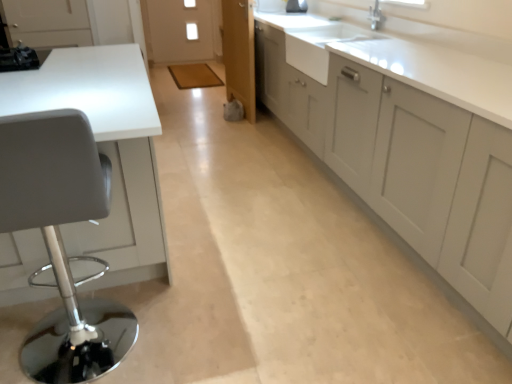
Question: Can you confirm if white glossy countertop at left is thinner than white ceramic sink at upper right?

Choices:
 (A) yes
 (B) no

Answer: (B)

Question: Is white glossy countertop at left in contact with white ceramic sink at upper right?

Choices:
 (A) no
 (B) yes

Answer: (A)

Question: Can you confirm if white glossy countertop at left is wider than white ceramic sink at upper right?

Choices:
 (A) no
 (B) yes

Answer: (B)

Question: From the image's perspective, is white glossy countertop at left on white ceramic sink at upper right?

Choices:
 (A) yes
 (B) no

Answer: (B)

Question: Considering the relative positions of white glossy countertop at left and white ceramic sink at upper right in the image provided, is white glossy countertop at left to the left of white ceramic sink at upper right from the viewer's perspective?

Choices:
 (A) yes
 (B) no

Answer: (A)

Question: From a real-world perspective, is white ceramic sink at upper right positioned above or below matte gray cabinets at right?

Choices:
 (A) below
 (B) above

Answer: (B)

Question: Considering the positions of point (373, 31) and point (333, 91), is point (373, 31) closer or farther from the camera than point (333, 91)?

Choices:
 (A) closer
 (B) farther

Answer: (B)

Question: Would you say white ceramic sink at upper right is inside or outside matte gray cabinets at right?

Choices:
 (A) inside
 (B) outside

Answer: (A)

Question: From the image's perspective, is white ceramic sink at upper right located above or below matte gray cabinets at right?

Choices:
 (A) below
 (B) above

Answer: (B)

Question: Is matte gray cabinets at right inside the boundaries of white ceramic sink at upper right, or outside?

Choices:
 (A) inside
 (B) outside

Answer: (B)

Question: From a real-world perspective, relative to white ceramic sink at upper right, is matte gray cabinets at right vertically above or below?

Choices:
 (A) above
 (B) below

Answer: (B)

Question: From the image's perspective, relative to white ceramic sink at upper right, is matte gray cabinets at right above or below?

Choices:
 (A) above
 (B) below

Answer: (B)

Question: In terms of width, does matte gray cabinets at right look wider or thinner when compared to white ceramic sink at upper right?

Choices:
 (A) wide
 (B) thin

Answer: (A)

Question: From the image's perspective, is white glossy countertop at left above or below matte gray cabinets at right?

Choices:
 (A) below
 (B) above

Answer: (A)

Question: Is white glossy countertop at left to the left or to the right of matte gray cabinets at right in the image?

Choices:
 (A) left
 (B) right

Answer: (A)